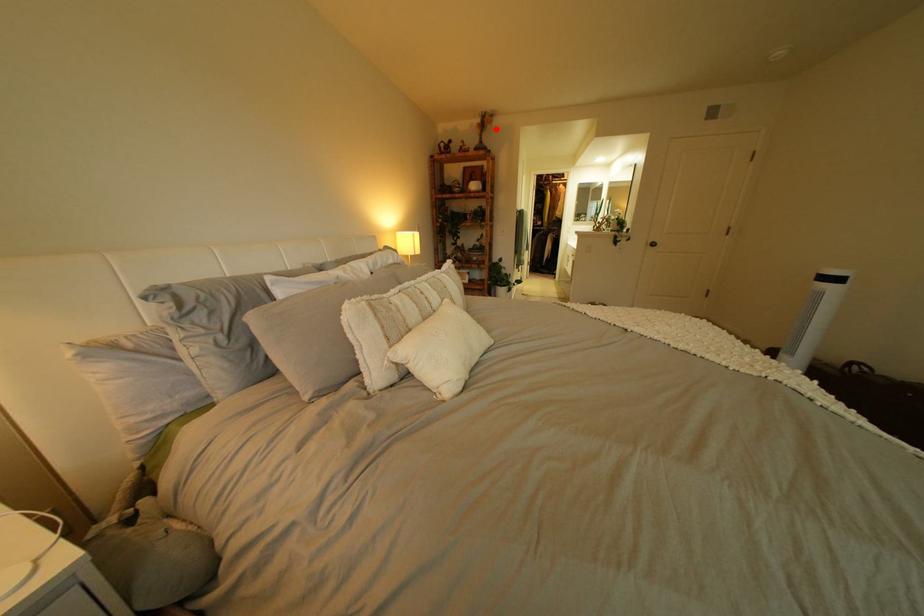
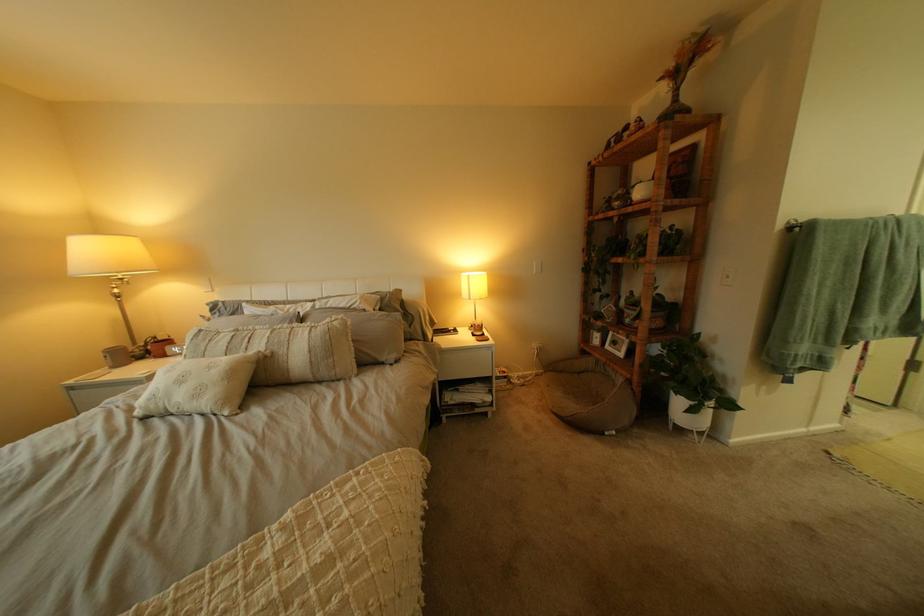
In the second image, find the point that corresponds to the highlighted location in the first image.

(675, 81)